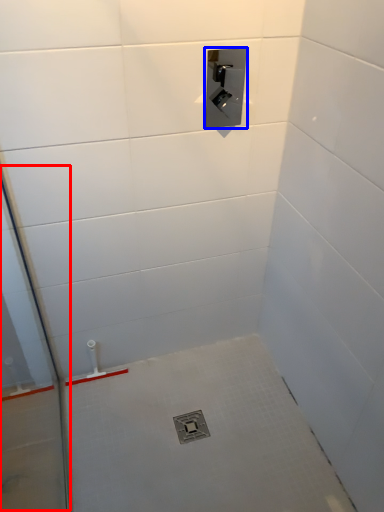
Question: Which point is further to the camera, glass door (highlighted by a red box) or plumbing fixture (highlighted by a blue box)?

Choices:
 (A) glass door
 (B) plumbing fixture

Answer: (B)